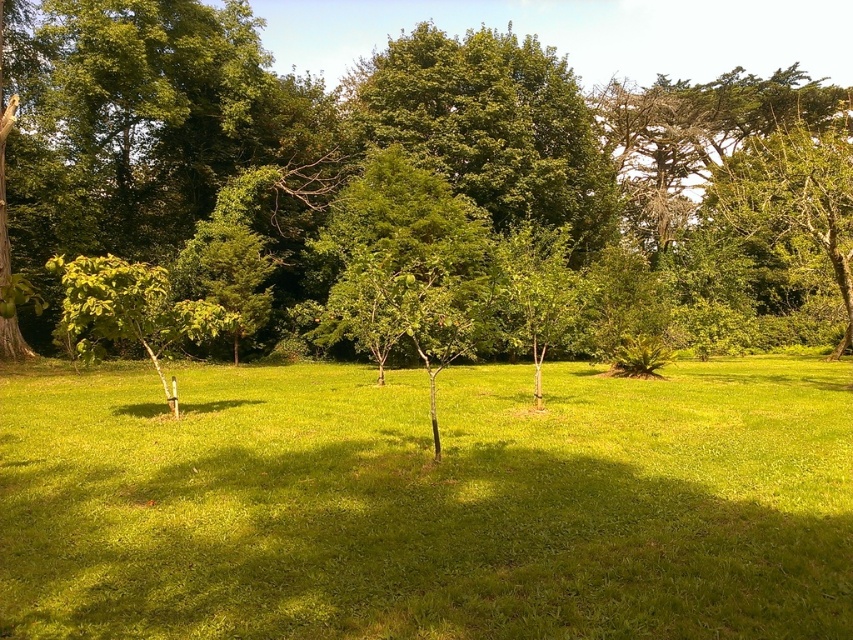
Is point (15, 97) more distant than point (175, 337)?

Yes, it is behind point (175, 337).

Does point (42, 45) come behind point (102, 314)?

Yes.

The width and height of the screenshot is (853, 640). In order to click on green leafy tree at center in this screenshot , I will do `click(407, 154)`.

Between green grass at center and green leafy tree at left, which one has more height?

With more height is green leafy tree at left.

Measure the distance between point (369, 461) and camera.

A distance of 8.04 meters exists between point (369, 461) and camera.

Identify the location of green grass at center. Image resolution: width=853 pixels, height=640 pixels. (428, 502).

Between point (476, 628) and point (35, 156), which one is positioned in front?

Point (476, 628) is more forward.

Who is lower down, green grass at center or green leafy tree at center?

green grass at center is below.

Is point (798, 598) behind point (190, 28)?

That is False.

Where is `green grass at center`? Image resolution: width=853 pixels, height=640 pixels. green grass at center is located at coordinates (428, 502).